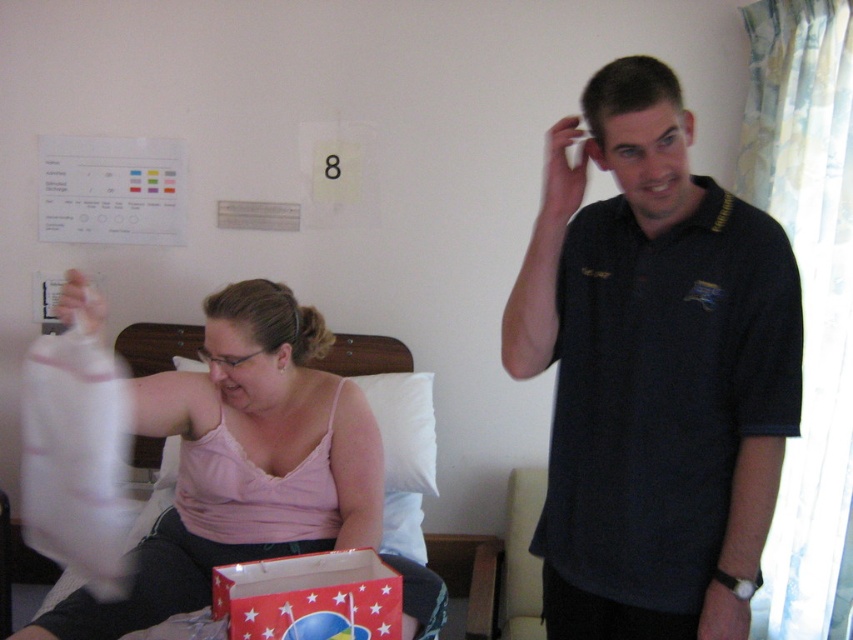
Is dark blue polo shirt at center behind pink fabric bag at center?

No, it is in front of pink fabric bag at center.

Is point (735, 353) closer to camera compared to point (206, 406)?

Yes, point (735, 353) is in front of point (206, 406).

Locate an element on the screen. The image size is (853, 640). dark blue polo shirt at center is located at coordinates (653, 372).

Can you confirm if pink fabric bag at center is positioned to the left of red paper bag at lower center?

Indeed, pink fabric bag at center is positioned on the left side of red paper bag at lower center.

This screenshot has height=640, width=853. What do you see at coordinates (242, 461) in the screenshot? I see `pink fabric bag at center` at bounding box center [242, 461].

What are the coordinates of `pink fabric bag at center` in the screenshot? It's located at (242, 461).

Can you confirm if dark blue polo shirt at center is taller than red paper bag at lower center?

Indeed, dark blue polo shirt at center has a greater height compared to red paper bag at lower center.

The width and height of the screenshot is (853, 640). What are the coordinates of `dark blue polo shirt at center` in the screenshot? It's located at (653, 372).